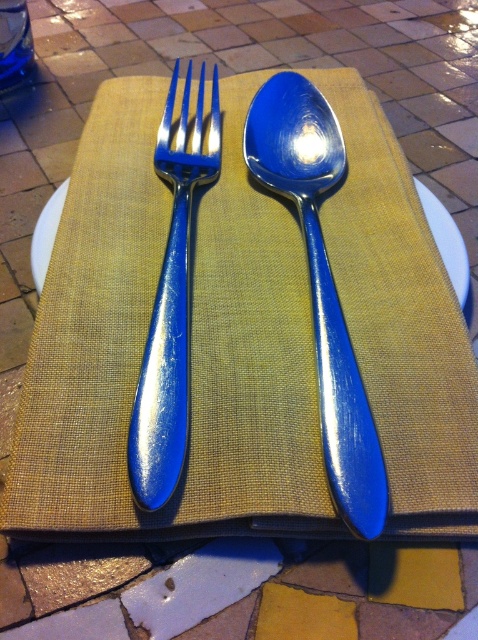
Which is more to the left, blue shiny spoon at center or shiny blue fork at center?

shiny blue fork at center

Who is positioned more to the right, blue shiny spoon at center or shiny blue fork at center?

Positioned to the right is blue shiny spoon at center.

Who is more forward, (276,83) or (184,284)?

Point (184,284) is in front.

Where is `blue shiny spoon at center`? The width and height of the screenshot is (478, 640). blue shiny spoon at center is located at coordinates (321, 285).